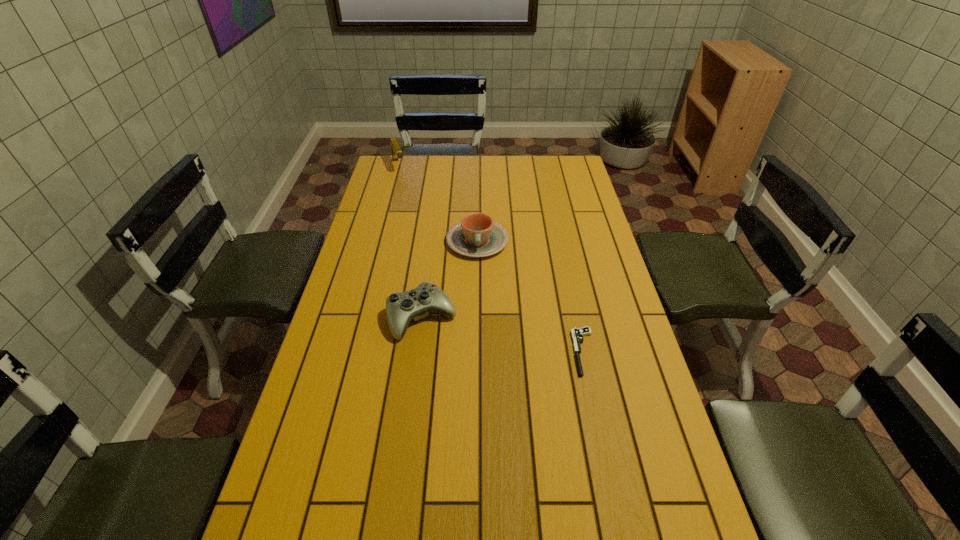
Where is `free space at the left edge`? The image size is (960, 540). free space at the left edge is located at coordinates (353, 249).

Locate an element on the screen. The width and height of the screenshot is (960, 540). free space at the right edge is located at coordinates (593, 302).

You are a GUI agent. You are given a task and a screenshot of the screen. Output one action in this format:
    pyautogui.click(x=<x>, y=<y>)
    Task: Click on the vacant space at the far right corner
    The height and width of the screenshot is (540, 960).
    Given the screenshot: What is the action you would take?
    pyautogui.click(x=553, y=160)

At what (x,y) coordinates should I click in order to perform the action: click on free region at the near right corner of the desktop. Please return your answer as a coordinate pair (x, y). This screenshot has width=960, height=540. Looking at the image, I should click on (632, 536).

Where is `free space between the control and the third nearest object`? free space between the control and the third nearest object is located at coordinates (449, 279).

Find the location of a particular element. This screenshot has width=960, height=540. vacant area that lies between the shortest object and the chinaware is located at coordinates (531, 296).

Locate an element on the screen. The image size is (960, 540). free spot between the farthest object and the control is located at coordinates (410, 241).

This screenshot has width=960, height=540. I want to click on free space between the chinaware and the shorter pistol, so click(531, 296).

At what (x,y) coordinates should I click in order to perform the action: click on free spot between the right pistol and the taller pistol. Please return your answer as a coordinate pair (x, y). The image size is (960, 540). Looking at the image, I should click on (492, 259).

This screenshot has width=960, height=540. In order to click on free point between the control and the taller pistol in this screenshot , I will do `click(410, 241)`.